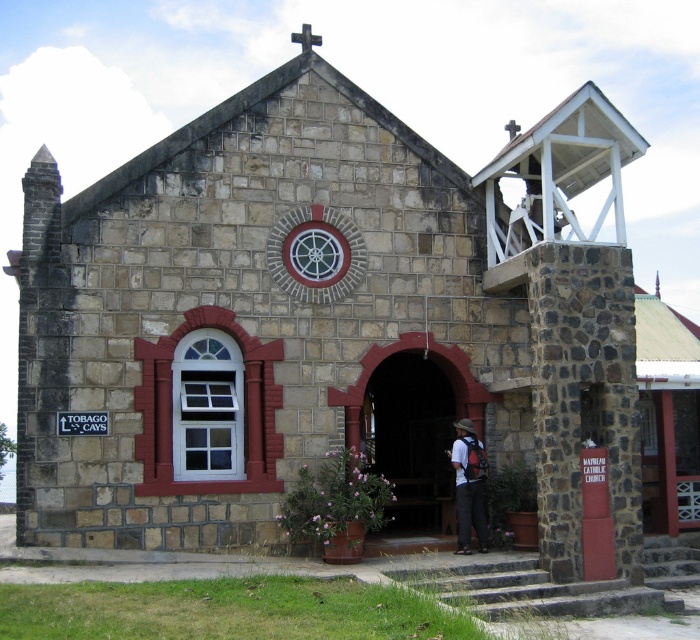
You are standing in front of the church and notice two items. One is the matte black backpack at lower center and the other is the black stone cross at upper center. Which item is positioned higher up on the church facade?

The black stone cross at upper center is positioned higher up on the church facade than the matte black backpack at lower center.